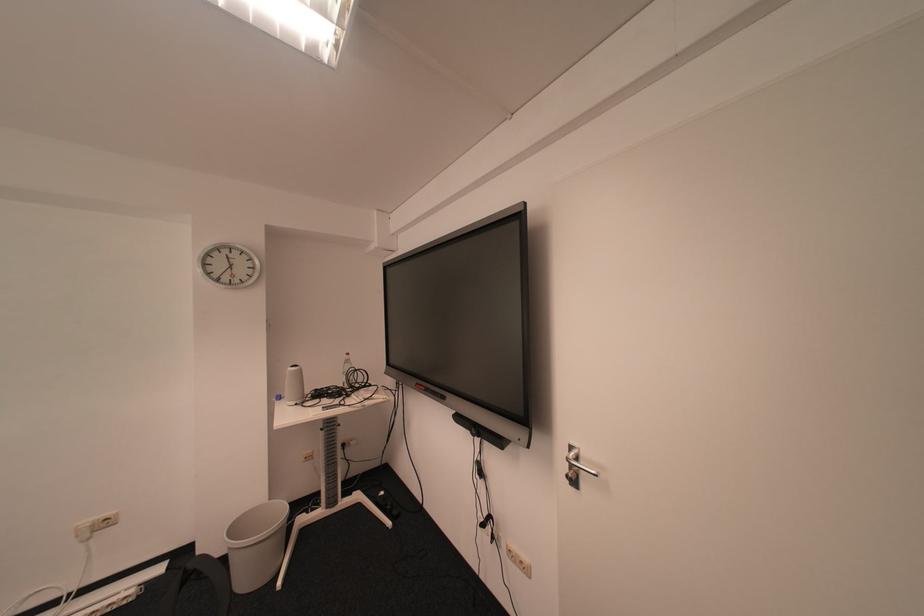
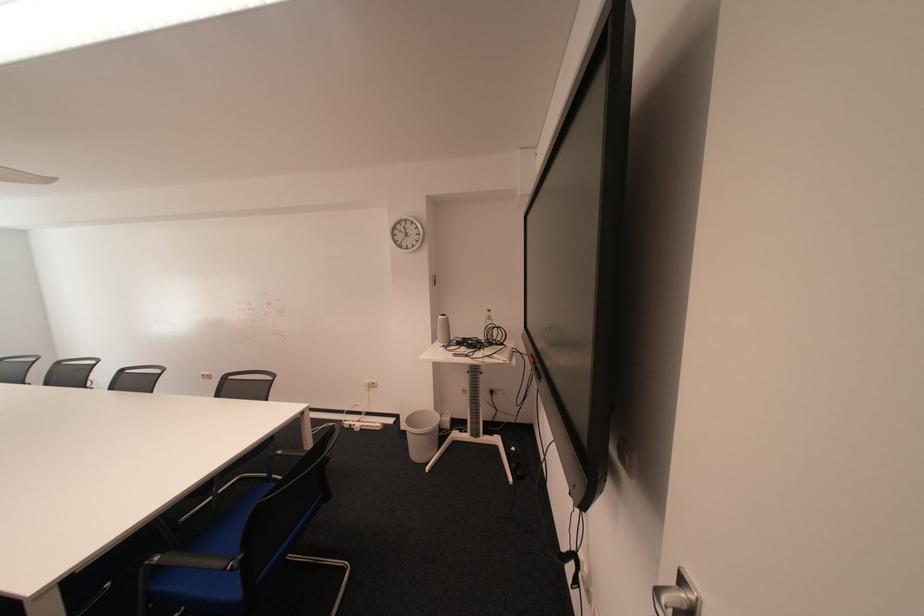
Question: The camera is either moving clockwise (left) or counter-clockwise (right) around the object. The first image is from the beginning of the video and the second image is from the end. Is the camera moving left or right when shooting the video?

Choices:
 (A) Left
 (B) Right

Answer: (B)